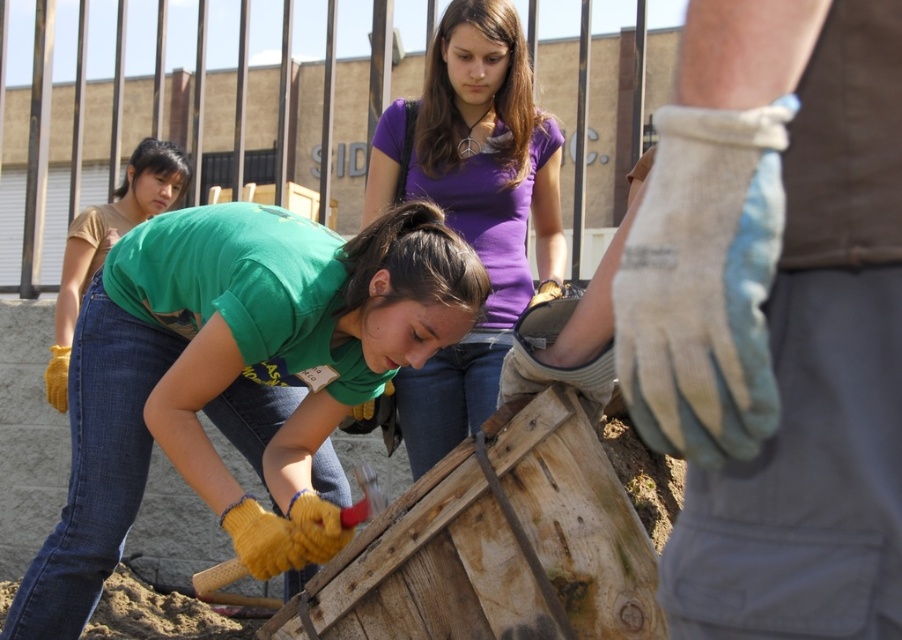
Does matte yellow gloves at lower left appear over purple cotton shirt at upper center?

Incorrect, matte yellow gloves at lower left is not positioned above purple cotton shirt at upper center.

Is point (89, 371) farther from viewer compared to point (417, 445)?

No, (89, 371) is in front of (417, 445).

At what (x,y) coordinates should I click in order to perform the action: click on matte yellow gloves at lower left. Please return your answer as a coordinate pair (x, y). This screenshot has width=902, height=640. Looking at the image, I should click on (237, 378).